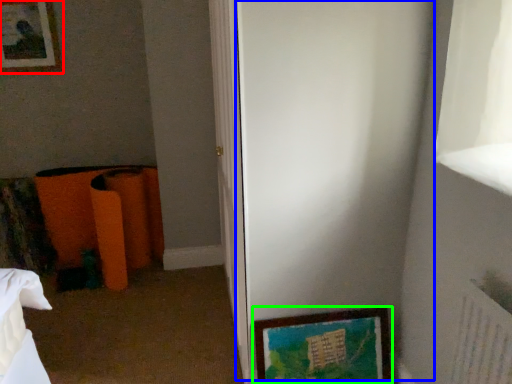
Question: Estimate the real-world distances between objects in this image. Which object is closer to picture frame (highlighted by a red box), screen door (highlighted by a blue box) or picture frame (highlighted by a green box)?

Choices:
 (A) screen door
 (B) picture frame

Answer: (A)